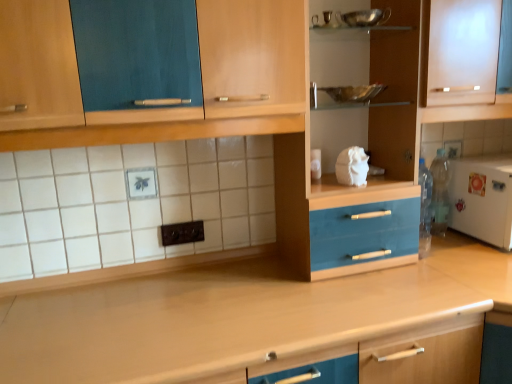
At what (x,y) coordinates should I click in order to perform the action: click on white matte refrigerator at right. Please return your answer as a coordinate pair (x, y). This screenshot has height=384, width=512. Looking at the image, I should click on (482, 198).

You are a GUI agent. You are given a task and a screenshot of the screen. Output one action in this format:
    pyautogui.click(x=<x>, y=<y>)
    Task: Click on the wooden at center
    This screenshot has width=512, height=384.
    Given the screenshot: What is the action you would take?
    pyautogui.click(x=236, y=316)

The height and width of the screenshot is (384, 512). Find the location of `frosted glass cabinet at upper right`. frosted glass cabinet at upper right is located at coordinates (461, 61).

Is frosted glass cabinet at upper right taller than wooden at center?

No, frosted glass cabinet at upper right is not taller than wooden at center.

Consider the image. From the image's perspective, is frosted glass cabinet at upper right located beneath wooden at center?

No, from the image's perspective, frosted glass cabinet at upper right is not below wooden at center.

Is frosted glass cabinet at upper right closer to camera compared to wooden at center?

That is False.

Is white matte refrigerator at right at the back of frosted glass cabinet at upper right?

No.

Considering the sizes of frosted glass cabinet at upper right and white matte refrigerator at right in the image, is frosted glass cabinet at upper right wider or thinner than white matte refrigerator at right?

Considering their sizes, frosted glass cabinet at upper right looks slimmer than white matte refrigerator at right.

From the image's perspective, would you say frosted glass cabinet at upper right is shown under white matte refrigerator at right?

No, from the image's perspective, frosted glass cabinet at upper right is not beneath white matte refrigerator at right.

Is frosted glass cabinet at upper right taller than white matte refrigerator at right?

Yes.

Considering the positions of objects metallic silver bowl at upper center and frosted glass cabinet at upper right in the image provided, who is more to the left, metallic silver bowl at upper center or frosted glass cabinet at upper right?

metallic silver bowl at upper center is more to the left.

Is metallic silver bowl at upper center turned away from frosted glass cabinet at upper right?

No.

Measure the distance between metallic silver bowl at upper center and frosted glass cabinet at upper right.

9.03 inches.

From the image's perspective, would you say frosted glass cabinet at upper right is positioned over metallic silver bowl at upper center?

No, from the image's perspective, frosted glass cabinet at upper right is not above metallic silver bowl at upper center.

What's the angular difference between frosted glass cabinet at upper right and metallic silver bowl at upper center's facing directions?

The angular difference between frosted glass cabinet at upper right and metallic silver bowl at upper center is 0.000736 degrees.

Is frosted glass cabinet at upper right wider than metallic silver bowl at upper center?

Yes, frosted glass cabinet at upper right is wider than metallic silver bowl at upper center.

Does frosted glass cabinet at upper right turn towards metallic silver bowl at upper center?

No, frosted glass cabinet at upper right is not turned towards metallic silver bowl at upper center.

Is wooden at center far from white matte refrigerator at right?

No, wooden at center is not far away from white matte refrigerator at right.

What's the angular difference between wooden at center and white matte refrigerator at right's facing directions?

0.000368 degrees.

Is wooden at center inside or outside of white matte refrigerator at right?

wooden at center lies outside white matte refrigerator at right.

What are the coordinates of `appliance that appears above the wooden at center (from the image's perspective)` in the screenshot? It's located at (482, 198).

Is wooden at center completely or partially inside white matte refrigerator at right?

No, wooden at center is located outside of white matte refrigerator at right.

Is white matte refrigerator at right far from wooden at center?

No, there isn't a large distance between white matte refrigerator at right and wooden at center.

From the image's perspective, is white matte refrigerator at right located above or below wooden at center?

Based on their image positions, white matte refrigerator at right is located above wooden at center.

From the image's perspective, which object appears higher, wooden at center or frosted glass cabinet at upper right?

From the image's view, frosted glass cabinet at upper right is above.

Between wooden at center and frosted glass cabinet at upper right, which one is positioned behind?

frosted glass cabinet at upper right.

Which of these two, wooden at center or frosted glass cabinet at upper right, is smaller?

With smaller size is frosted glass cabinet at upper right.

From a real-world perspective, relative to frosted glass cabinet at upper right, is wooden at center vertically above or below?

From a real-world perspective, wooden at center is physically below frosted glass cabinet at upper right.

This screenshot has width=512, height=384. There is a wooden at center. Find the location of `cabinetry above it (from a real-world perspective)`. cabinetry above it (from a real-world perspective) is located at coordinates (461, 61).

You are a GUI agent. You are given a task and a screenshot of the screen. Output one action in this format:
    pyautogui.click(x=<x>, y=<y>)
    Task: Click on the cabinetry lying in front of the white matte refrigerator at right
    
    Given the screenshot: What is the action you would take?
    pyautogui.click(x=461, y=61)

When comparing their distances from frosted glass cabinet at upper right, does white matte refrigerator at right or metallic silver bowl at upper center seem further?

The object further to frosted glass cabinet at upper right is white matte refrigerator at right.

From the image, which object appears to be farther from wooden at center, frosted glass cabinet at upper right or white matte refrigerator at right?

frosted glass cabinet at upper right is positioned further to the anchor wooden at center.

Which object lies further to the anchor point frosted glass cabinet at upper right, white matte refrigerator at right or wooden at center?

wooden at center lies further to frosted glass cabinet at upper right than the other object.

Considering their positions, is frosted glass cabinet at upper right positioned closer to wooden at center than metallic silver bowl at upper center?

frosted glass cabinet at upper right.

From the image, which object appears to be farther from metallic silver bowl at upper center, white matte refrigerator at right or frosted glass cabinet at upper right?

white matte refrigerator at right lies further to metallic silver bowl at upper center than the other object.

When comparing their distances from metallic silver bowl at upper center, does white matte refrigerator at right or wooden at center seem further?

The object further to metallic silver bowl at upper center is wooden at center.

From the image, which object appears to be nearer to white matte refrigerator at right, metallic silver bowl at upper center or frosted glass cabinet at upper right?

frosted glass cabinet at upper right lies closer to white matte refrigerator at right than the other object.

Which object lies nearer to the anchor point wooden at center, metallic silver bowl at upper center or white matte refrigerator at right?

Among the two, white matte refrigerator at right is located nearer to wooden at center.

Find the location of `cabinetry between metallic silver bowl at upper center and white matte refrigerator at right from left to right`. cabinetry between metallic silver bowl at upper center and white matte refrigerator at right from left to right is located at coordinates (461, 61).

Identify the location of appliance between metallic silver bowl at upper center and wooden at center from top to bottom. The image size is (512, 384). (482, 198).

This screenshot has width=512, height=384. I want to click on cabinetry that lies between metallic silver bowl at upper center and wooden at center from top to bottom, so click(461, 61).

Where is `appliance between frosted glass cabinet at upper right and wooden at center in the up-down direction`? Image resolution: width=512 pixels, height=384 pixels. appliance between frosted glass cabinet at upper right and wooden at center in the up-down direction is located at coordinates (482, 198).